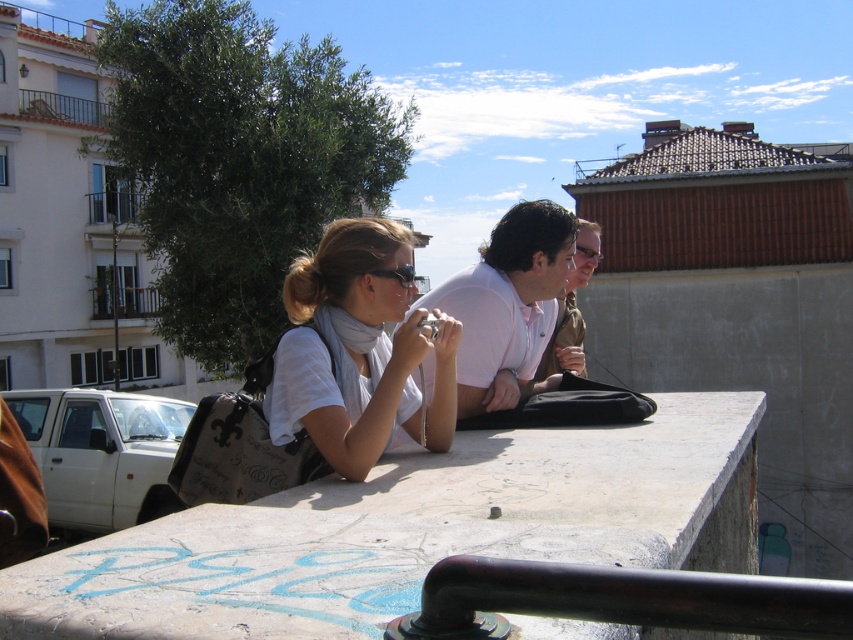
Based on the photo, you are standing in an urban area and see two points marked in the scene. Which point is closer to you, point [454,336] or point [471,604]?

Point [454,336] is further to the viewer than point [471,604], so the closer point to you is point [471,604].

You are a delivery robot with a package that needs to be placed between the white matte scarf at center and the matte white shirt at center. The package is 1.2 meters long. Can the package fit between them?

The distance between the white matte scarf at center and the matte white shirt at center is 1.27 meters, so the package that is 1.2 meters long can fit between them since it is shorter than the available space.

You are a photographer trying to capture the scene from the same angle as the woman with the camera. To ensure the white matte scarf at center is in the frame, where should you position it in your camera viewfinder?

The white matte scarf at center is located at the coordinates 0.548 on the x axis and 0.422 on the y axis, so you should position it at that point in your camera viewfinder to capture it in the frame.